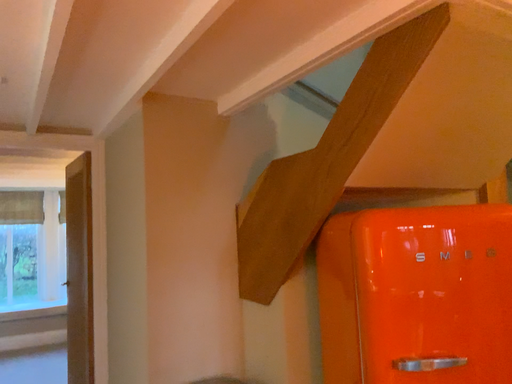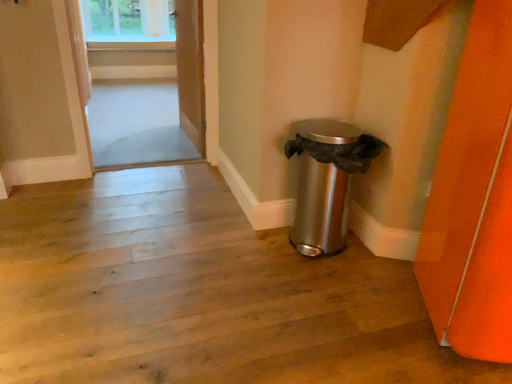
Question: Which way did the camera rotate in the video?

Choices:
 (A) rotated downward
 (B) rotated upward

Answer: (A)